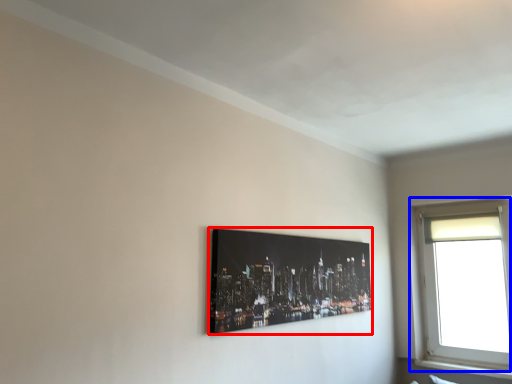
Question: Which point is closer to the camera, picture frame (highlighted by a red box) or window (highlighted by a blue box)?

Choices:
 (A) picture frame
 (B) window

Answer: (A)